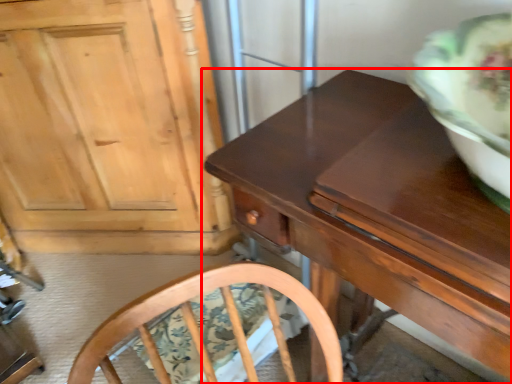
Question: Observing the image, what is the correct spatial positioning of table (annotated by the red box) in reference to cabinetry?

Choices:
 (A) left
 (B) right

Answer: (B)